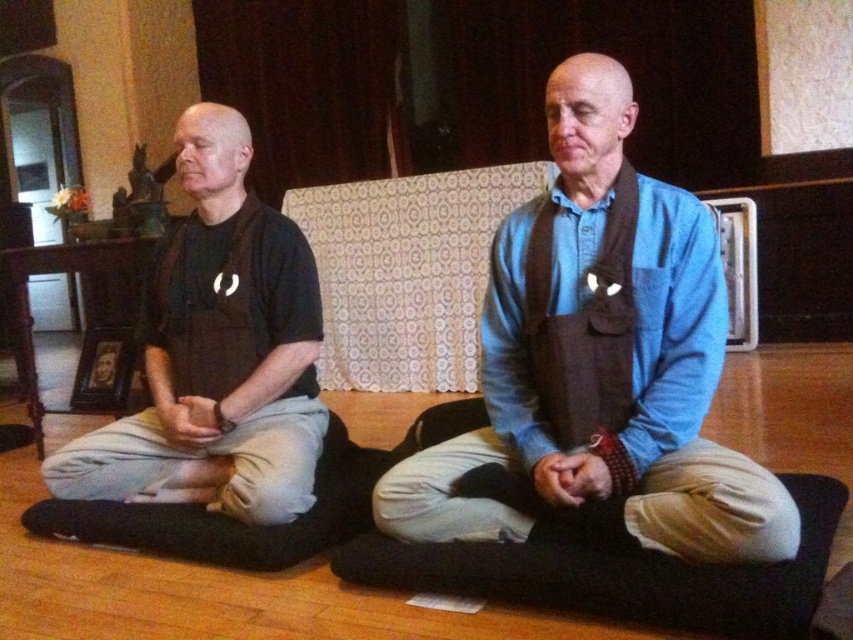
Between point (606, 148) and point (100, 476), which one is positioned behind?

The point (100, 476) is behind.

Is blue cotton shirt at center positioned at the back of matte black shirt at left?

No, blue cotton shirt at center is in front of matte black shirt at left.

Measure the distance between point [579,468] and camera.

Point [579,468] and camera are 1.49 meters apart from each other.

This screenshot has height=640, width=853. What are the coordinates of `blue cotton shirt at center` in the screenshot? It's located at (625, 422).